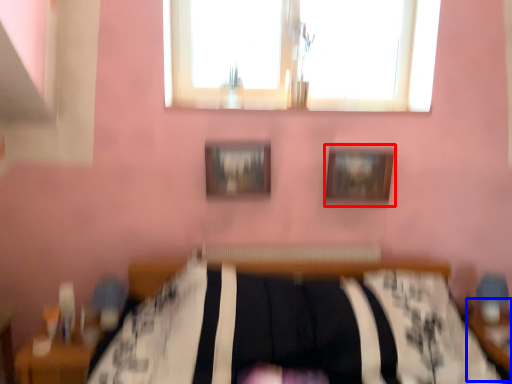
Question: Which object appears farthest to the camera in this image, picture frame (highlighted by a red box) or table (highlighted by a blue box)?

Choices:
 (A) picture frame
 (B) table

Answer: (A)